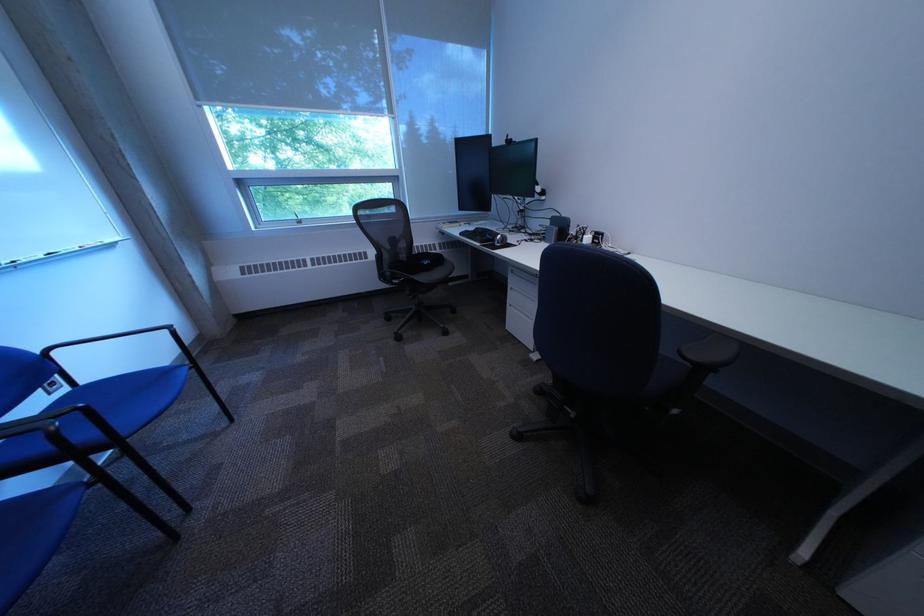
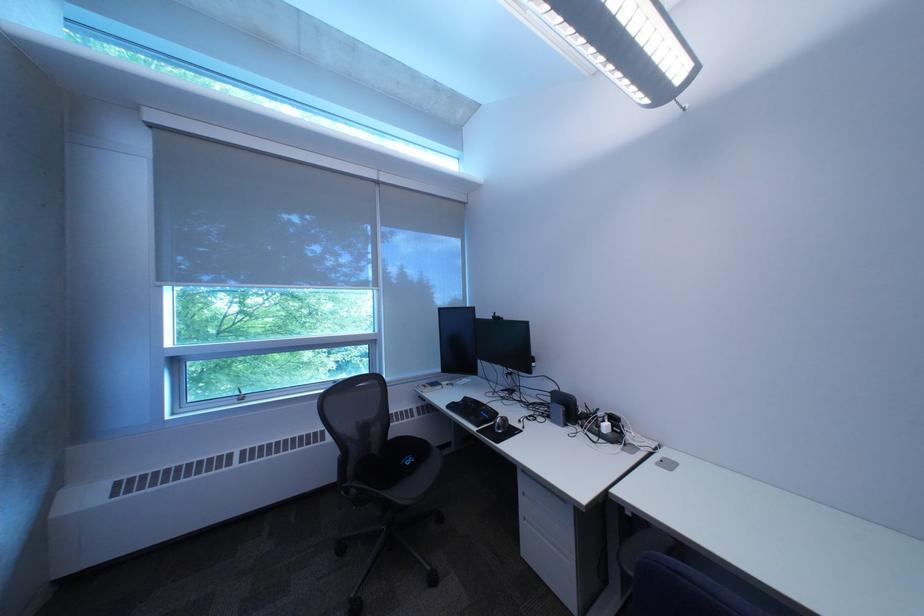
Find the pixel in the second image that matches (441,262) in the first image.

(423, 461)